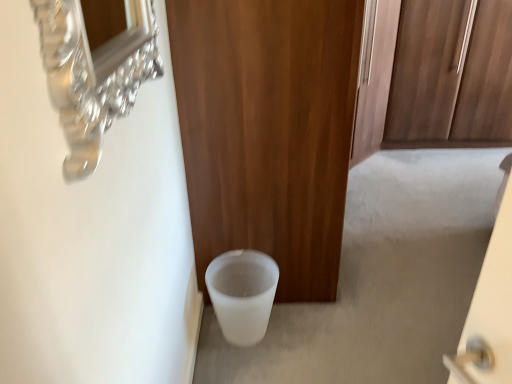
Question: From a real-world perspective, does wooden door at center stand above white frosted glass toilet bowl at lower left?

Choices:
 (A) no
 (B) yes

Answer: (B)

Question: Is wooden door at center facing towards white frosted glass toilet bowl at lower left?

Choices:
 (A) no
 (B) yes

Answer: (A)

Question: Is wooden door at center surrounding white frosted glass toilet bowl at lower left?

Choices:
 (A) no
 (B) yes

Answer: (A)

Question: Is wooden door at center outside white frosted glass toilet bowl at lower left?

Choices:
 (A) yes
 (B) no

Answer: (A)

Question: Considering the relative sizes of wooden door at center and white frosted glass toilet bowl at lower left in the image provided, is wooden door at center smaller than white frosted glass toilet bowl at lower left?

Choices:
 (A) yes
 (B) no

Answer: (B)

Question: Is wooden door at center taller or shorter than white frosted glass toilet bowl at lower left?

Choices:
 (A) short
 (B) tall

Answer: (B)

Question: From a real-world perspective, is wooden door at center positioned above or below white frosted glass toilet bowl at lower left?

Choices:
 (A) below
 (B) above

Answer: (B)

Question: Based on their sizes in the image, would you say wooden door at center is bigger or smaller than white frosted glass toilet bowl at lower left?

Choices:
 (A) big
 (B) small

Answer: (A)

Question: Is wooden door at center inside or outside of white frosted glass toilet bowl at lower left?

Choices:
 (A) outside
 (B) inside

Answer: (A)

Question: Based on their sizes in the image, would you say white matte trash can at lower center is bigger or smaller than wooden door at center?

Choices:
 (A) big
 (B) small

Answer: (B)

Question: Based on their positions, is white matte trash can at lower center located to the left or right of wooden door at center?

Choices:
 (A) right
 (B) left

Answer: (A)

Question: From a real-world perspective, is white matte trash can at lower center physically located above or below wooden door at center?

Choices:
 (A) above
 (B) below

Answer: (B)

Question: In terms of height, does white matte trash can at lower center look taller or shorter compared to wooden door at center?

Choices:
 (A) short
 (B) tall

Answer: (A)

Question: Considering the relative positions of wooden door at center and white matte trash can at lower center in the image provided, is wooden door at center to the left or to the right of white matte trash can at lower center?

Choices:
 (A) left
 (B) right

Answer: (A)

Question: From the image's perspective, is wooden door at center above or below white matte trash can at lower center?

Choices:
 (A) below
 (B) above

Answer: (B)